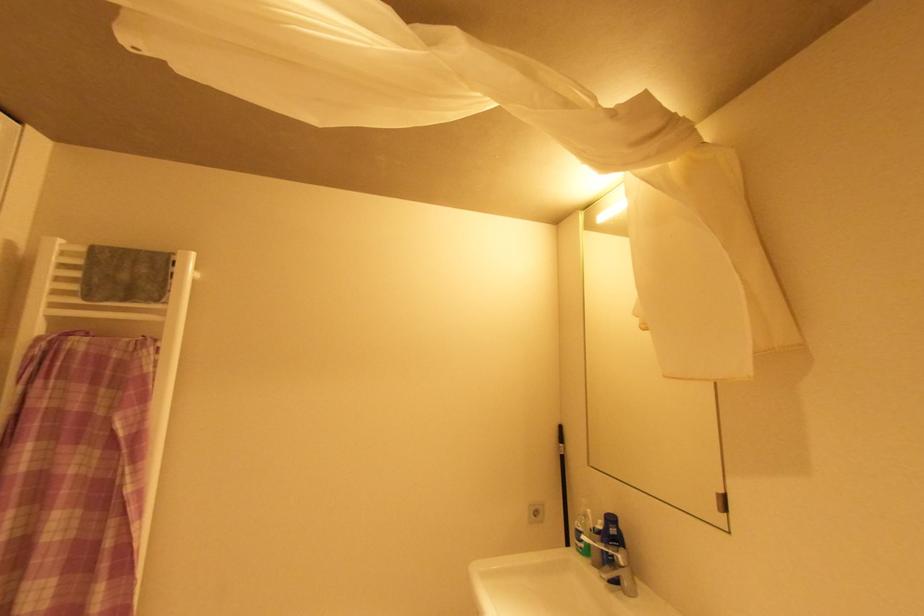
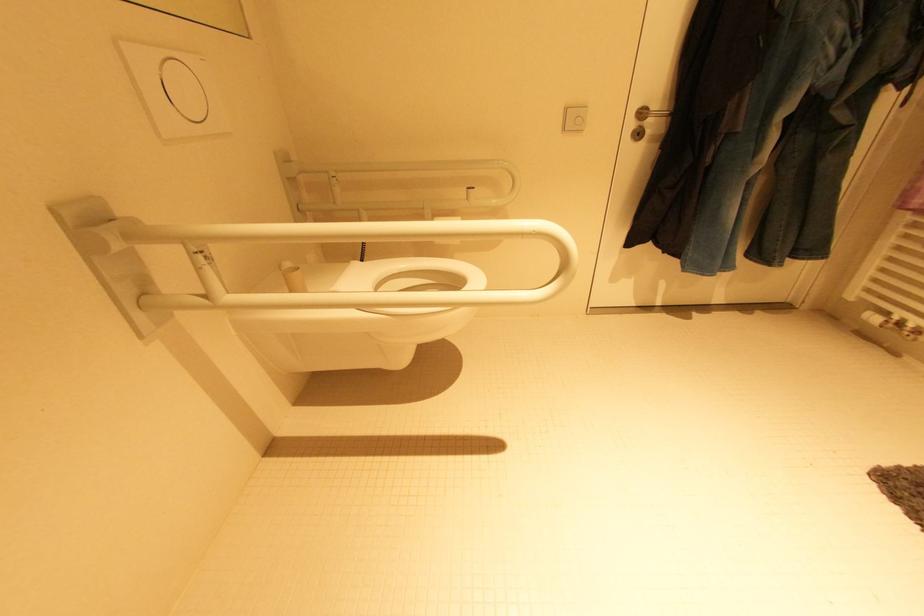
The images are taken continuously from a first-person perspective. In which direction is your viewpoint rotating?

The camera's rotation is toward left-down.